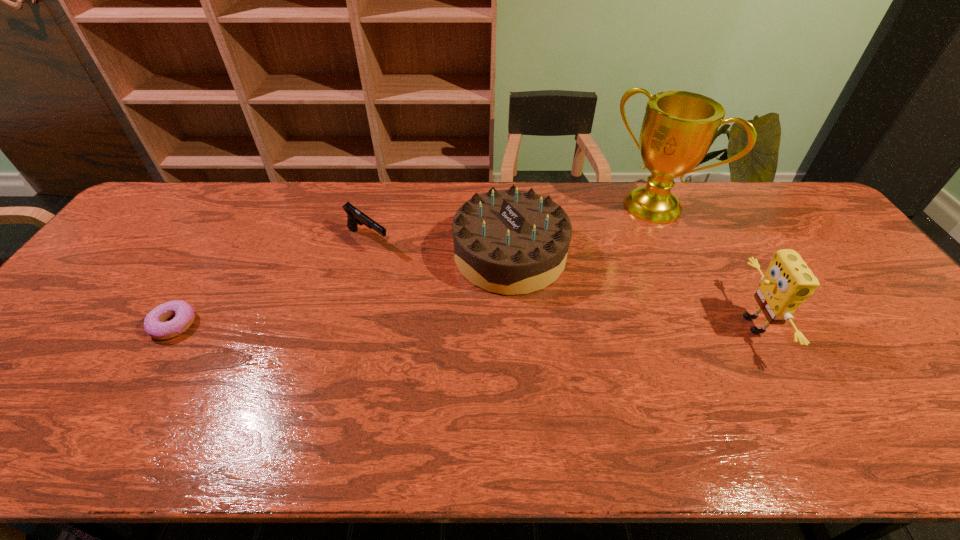
Image resolution: width=960 pixels, height=540 pixels. In order to click on vacant space located 0.270m on the shiny surface of the award in this screenshot , I will do `click(588, 273)`.

Identify the location of birthday cake that is at the far edge. This screenshot has width=960, height=540. (512, 242).

At what (x,y) coordinates should I click in order to perform the action: click on gun at the far edge. Please return your answer as a coordinate pair (x, y). Looking at the image, I should click on (355, 216).

Image resolution: width=960 pixels, height=540 pixels. What are the coordinates of `award that is positioned at the far edge` in the screenshot? It's located at (678, 128).

What are the coordinates of `vacant space at the far edge of the desktop` in the screenshot? It's located at click(722, 211).

At what (x,y) coordinates should I click in order to perform the action: click on vacant space at the left edge of the desktop. Please return your answer as a coordinate pair (x, y). Looking at the image, I should click on (166, 248).

Where is `free space at the far left corner`? This screenshot has height=540, width=960. free space at the far left corner is located at coordinates (172, 191).

Locate an element on the screen. vacant space that's between the shortest object and the tallest object is located at coordinates (414, 266).

The image size is (960, 540). What are the coordinates of `vacant area that lies between the fourth tallest object and the birthday cake` in the screenshot? It's located at (439, 247).

Image resolution: width=960 pixels, height=540 pixels. In order to click on free space between the shortest object and the gun in this screenshot , I will do `click(271, 282)`.